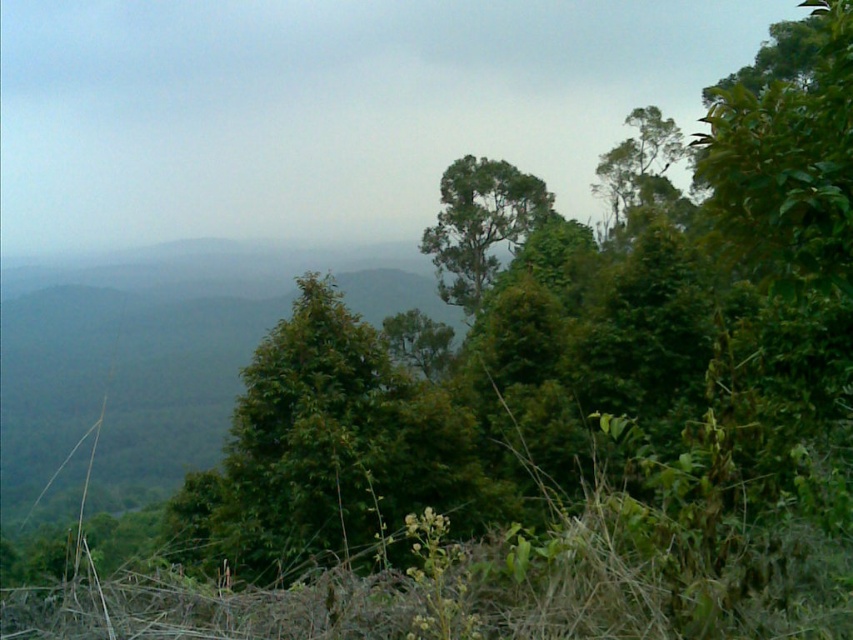
Question: Which point is farther to the camera?

Choices:
 (A) green leafy tree at upper right
 (B) green leafy tree at center

Answer: (B)

Question: Among these objects, which one is farthest from the camera?

Choices:
 (A) green leafy tree at center
 (B) green leafy tree at upper right

Answer: (A)

Question: Considering the relative positions of green leafy tree at center and green leafy tree at upper right in the image provided, where is green leafy tree at center located with respect to green leafy tree at upper right?

Choices:
 (A) left
 (B) right

Answer: (A)

Question: Does green leafy tree at center have a smaller size compared to green leafy tree at upper right?

Choices:
 (A) yes
 (B) no

Answer: (A)

Question: Does green leafy tree at center appear on the left side of green leafy tree at upper right?

Choices:
 (A) no
 (B) yes

Answer: (B)

Question: Which point is farther to the camera?

Choices:
 (A) (474, 292)
 (B) (633, 192)

Answer: (A)